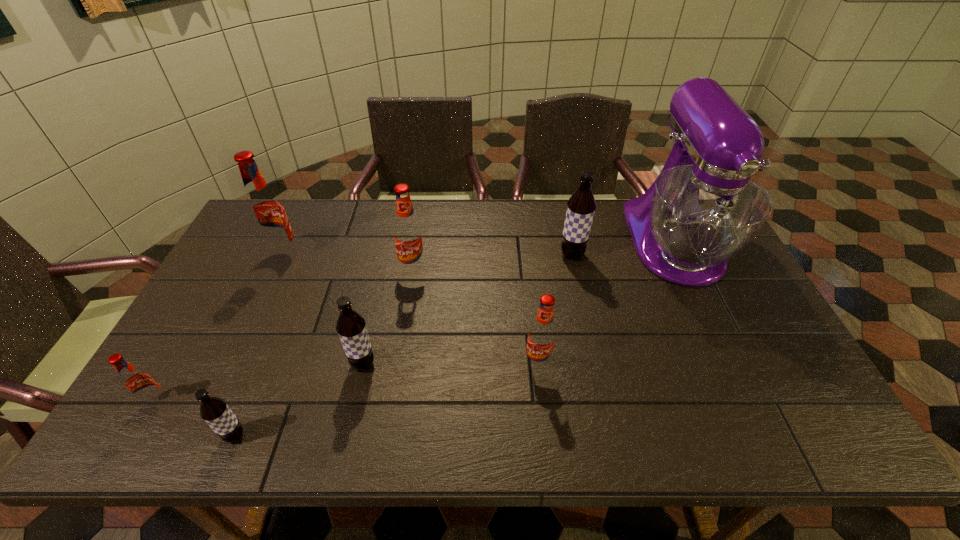
This screenshot has width=960, height=540. I want to click on vacant space located 0.180m on the front of the third object from right to left, so click(x=547, y=444).

Where is `vacant space located on the front of the fourth root beer from left to right`? This screenshot has width=960, height=540. vacant space located on the front of the fourth root beer from left to right is located at coordinates (348, 430).

At what (x,y) coordinates should I click in order to perform the action: click on vacant space located 0.070m on the right of the leftmost object. Please return your answer as a coordinate pair (x, y). This screenshot has width=960, height=540. Looking at the image, I should click on (197, 402).

Where is `vacant space located 0.220m on the back of the nearest root beer`? Image resolution: width=960 pixels, height=540 pixels. vacant space located 0.220m on the back of the nearest root beer is located at coordinates (272, 346).

The height and width of the screenshot is (540, 960). I want to click on object at the far edge, so click(703, 209).

Where is `object present at the right edge`? This screenshot has height=540, width=960. object present at the right edge is located at coordinates (703, 209).

Find the location of a particular element. This screenshot has width=960, height=540. object that is at the near left corner is located at coordinates (138, 383).

In order to click on object that is at the far right corner in this screenshot , I will do `click(703, 209)`.

At what (x,y) coordinates should I click in order to perform the action: click on vacant space at the far edge of the desktop. Please return your answer as a coordinate pair (x, y). Image resolution: width=960 pixels, height=540 pixels. Looking at the image, I should click on (359, 235).

Find the location of a particular element. blank space at the near edge of the desktop is located at coordinates (636, 427).